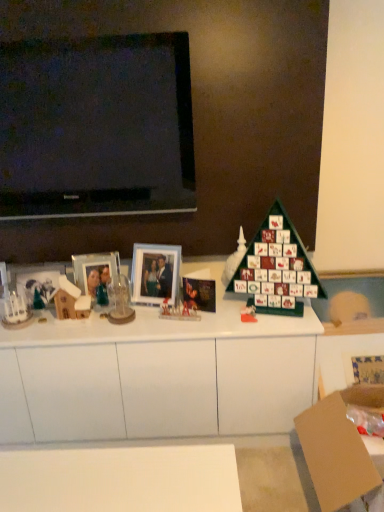
Locate an element on the screen. The height and width of the screenshot is (512, 384). free spot to the right of green matte advent calendar at center, marked as the fourth toy in a left-to-right arrangement is located at coordinates (287, 321).